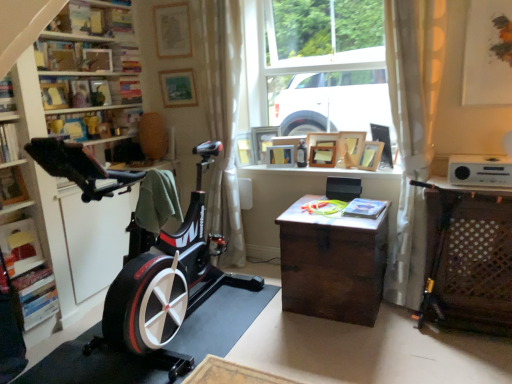
Question: Looking at their shapes, would you say wooden picture frame at center, acting as the fourth picture frame starting from the left, is wider or thinner than hardcover book at left, which ranks as the third book in right-to-left order?

Choices:
 (A) wide
 (B) thin

Answer: (B)

Question: From their relative heights in the image, would you say wooden picture frame at center, acting as the fourth picture frame starting from the left, is taller or shorter than hardcover book at left, which is the third book in bottom-to-top order?

Choices:
 (A) tall
 (B) short

Answer: (A)

Question: Which object is the closest to the matte white picture frame at upper right, arranged as the first picture frame when viewed from the right?

Choices:
 (A) matte gold picture frame at upper center, placed as the 1th picture frame when sorted from left to right
 (B) hardcover book at left, arranged as the first book when viewed from the top
 (C) wooden picture frame at upper right, the second picture frame from the right
 (D) wooden picture frame at upper center, the 3th picture frame when ordered from right to left
 (E) matte wooden picture frame at upper center, positioned as the 10th picture frame in right-to-left order

Answer: (C)

Question: Based on their relative distances, which object is farther from the wooden picture frame at upper center, acting as the seventh picture frame starting from the right?

Choices:
 (A) matte white picture frame at upper right, arranged as the first picture frame when viewed from the right
 (B) matte wood shelf at upper left, the 2th shelf from the bottom
 (C) white sheer curtain at center, which is counted as the second curtain, starting from the right
 (D) wooden chest at right
 (E) wooden picture frame at upper right, which appears as the 10th picture frame when viewed from the left

Answer: (D)